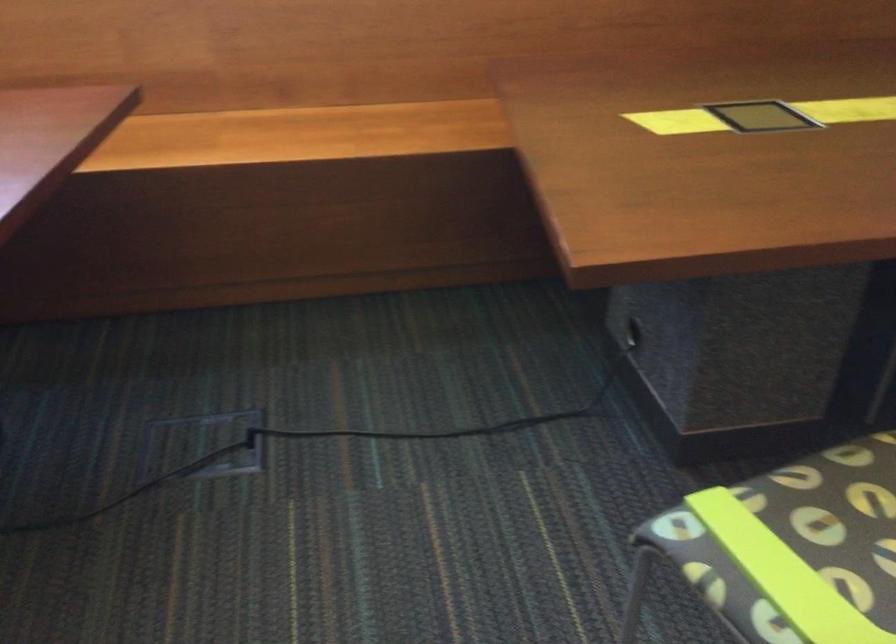
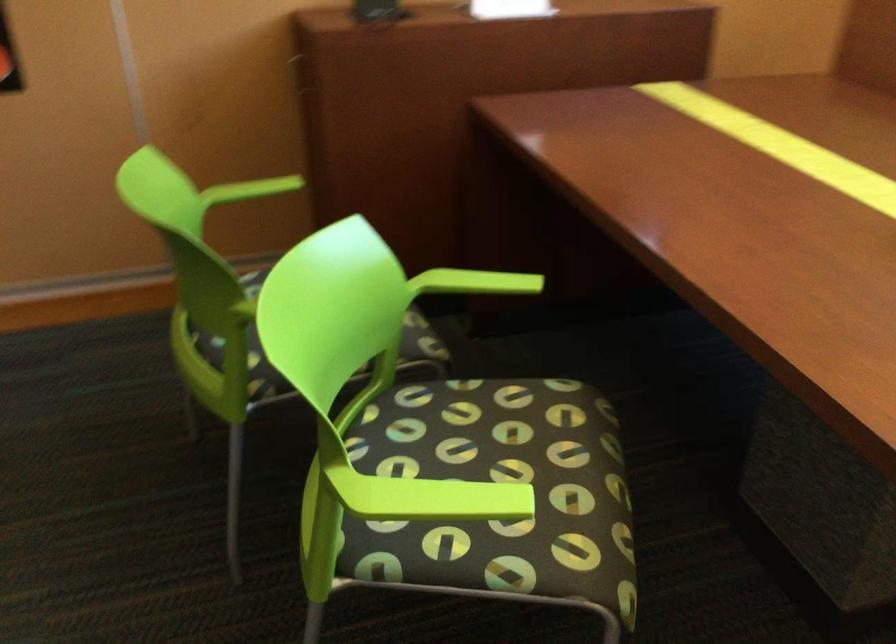
How did the camera likely rotate?

The camera rotated toward left-down.